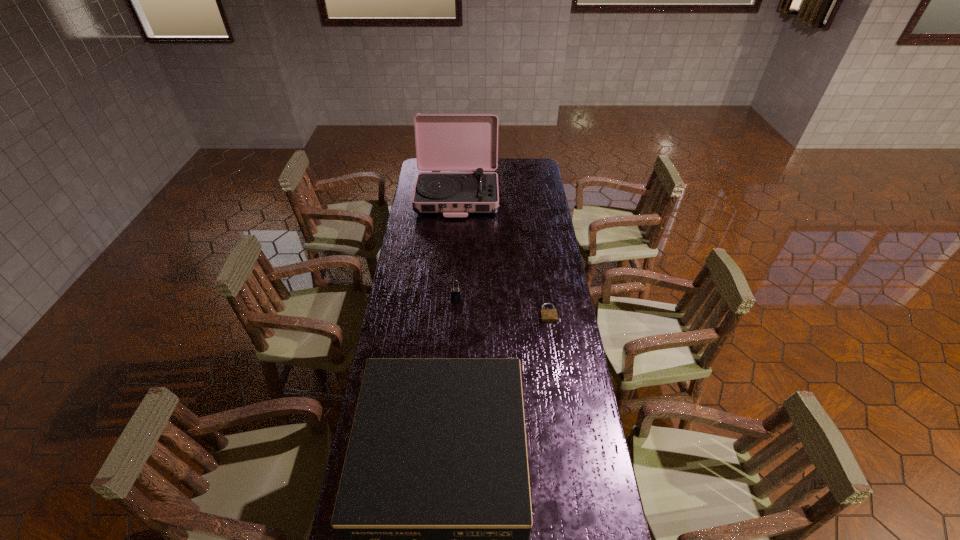
The height and width of the screenshot is (540, 960). I want to click on the tallest object, so [x=444, y=142].

You are a GUI agent. You are given a task and a screenshot of the screen. Output one action in this format:
    pyautogui.click(x=<x>, y=<y>)
    Task: Click on the record player
    The width and height of the screenshot is (960, 540).
    Given the screenshot: What is the action you would take?
    pyautogui.click(x=444, y=142)

The width and height of the screenshot is (960, 540). I want to click on the left padlock, so click(455, 292).

This screenshot has height=540, width=960. Identify the location of the third tallest object. (455, 292).

Find the location of a particular element. the shorter padlock is located at coordinates (547, 315).

What are the coordinates of `the rightmost object` in the screenshot? It's located at (547, 315).

Find the location of `free location located with the lid open on the farthest object`. free location located with the lid open on the farthest object is located at coordinates (455, 234).

Image resolution: width=960 pixels, height=540 pixels. In order to click on vacant region located on the shackle of the second farthest object in this screenshot , I will do `click(454, 339)`.

Where is `vacant space located on the keyhole side of the shorter padlock`? vacant space located on the keyhole side of the shorter padlock is located at coordinates (564, 413).

You are a GUI agent. You are given a task and a screenshot of the screen. Output one action in this format:
    pyautogui.click(x=<x>, y=<y>)
    Task: Click on the object situated at the far edge
    
    Given the screenshot: What is the action you would take?
    (444, 142)